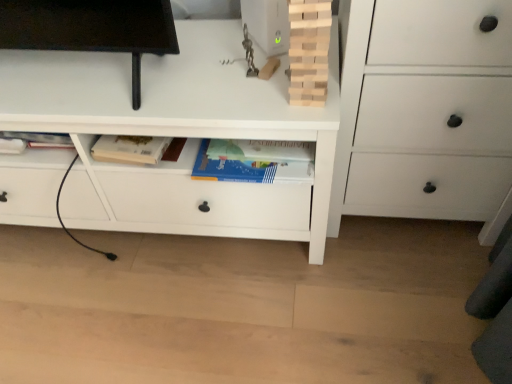
Question: From a real-world perspective, does white matte chest of drawers at right, which ranks as the 1th chest of drawers in right-to-left order, sit lower than natural wood tower at upper center?

Choices:
 (A) yes
 (B) no

Answer: (A)

Question: Is the depth of white matte chest of drawers at right, which ranks as the 1th chest of drawers in right-to-left order, greater than that of natural wood tower at upper center?

Choices:
 (A) yes
 (B) no

Answer: (B)

Question: Does white matte chest of drawers at right, which ranks as the 1th chest of drawers in right-to-left order, turn towards natural wood tower at upper center?

Choices:
 (A) yes
 (B) no

Answer: (B)

Question: Considering the relative sizes of white matte chest of drawers at right, which ranks as the 1th chest of drawers in right-to-left order, and natural wood tower at upper center in the image provided, is white matte chest of drawers at right, which ranks as the 1th chest of drawers in right-to-left order, bigger than natural wood tower at upper center?

Choices:
 (A) no
 (B) yes

Answer: (B)

Question: From the image's perspective, does white matte chest of drawers at right, which ranks as the 1th chest of drawers in right-to-left order, appear lower than natural wood tower at upper center?

Choices:
 (A) yes
 (B) no

Answer: (A)

Question: Is white matte chest of drawers at center, the first chest of drawers when ordered from left to right, to the left or to the right of natural wood tower at upper center in the image?

Choices:
 (A) right
 (B) left

Answer: (B)

Question: Is white matte chest of drawers at center, the second chest of drawers when ordered from right to left, situated inside natural wood tower at upper center or outside?

Choices:
 (A) inside
 (B) outside

Answer: (B)

Question: Is point (455, 62) positioned closer to the camera than point (306, 46)?

Choices:
 (A) closer
 (B) farther

Answer: (B)

Question: Is white matte chest of drawers at center, the first chest of drawers when ordered from left to right, bigger or smaller than natural wood tower at upper center?

Choices:
 (A) big
 (B) small

Answer: (A)

Question: In the image, is natural wood tower at upper center on the left side or the right side of white matte chest of drawers at right, which ranks as the 1th chest of drawers in right-to-left order?

Choices:
 (A) right
 (B) left

Answer: (B)

Question: Considering the positions of point pos(297,104) and point pos(434,67), is point pos(297,104) closer or farther from the camera than point pos(434,67)?

Choices:
 (A) closer
 (B) farther

Answer: (B)

Question: Relative to white matte chest of drawers at right, the second chest of drawers from the left, is natural wood tower at upper center in front or behind?

Choices:
 (A) front
 (B) behind

Answer: (B)

Question: From the image's perspective, is natural wood tower at upper center above or below white matte chest of drawers at right, which ranks as the 1th chest of drawers in right-to-left order?

Choices:
 (A) below
 (B) above

Answer: (B)

Question: Is natural wood tower at upper center in front of or behind white matte chest of drawers at center, the first chest of drawers when ordered from left to right, in the image?

Choices:
 (A) front
 (B) behind

Answer: (A)

Question: Does point (304, 4) appear closer or farther from the camera than point (147, 187)?

Choices:
 (A) farther
 (B) closer

Answer: (B)